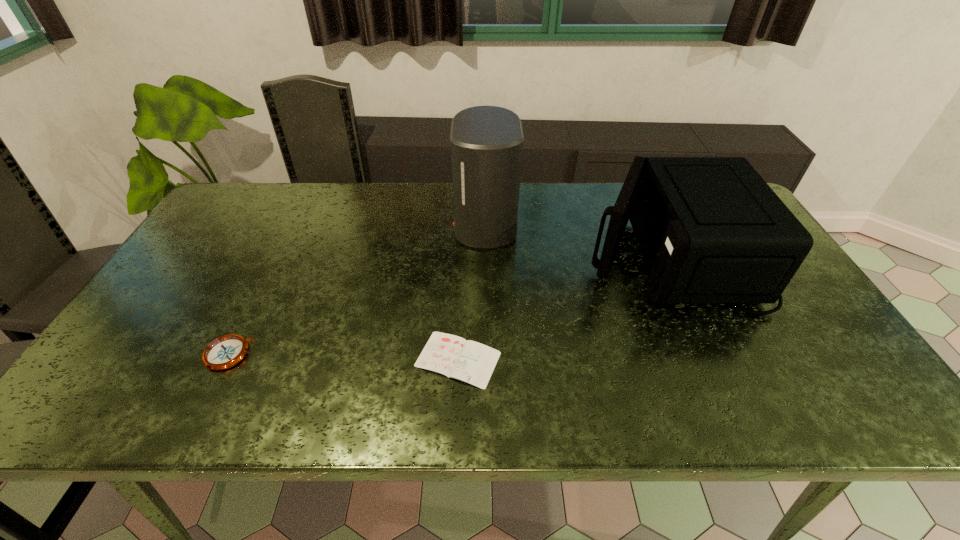
Where is `vacant area located 0.050m with the door open on the rightmost object`? The width and height of the screenshot is (960, 540). vacant area located 0.050m with the door open on the rightmost object is located at coordinates (565, 253).

Locate an element on the screen. vacant space situated with the door open on the rightmost object is located at coordinates (489, 253).

At what (x,y) coordinates should I click in order to perform the action: click on vacant region located 0.090m on the left of the leftmost object. Please return your answer as a coordinate pair (x, y). This screenshot has width=960, height=540. Looking at the image, I should click on (167, 354).

The height and width of the screenshot is (540, 960). In order to click on free spot located on the right of the diary in this screenshot , I will do `click(559, 359)`.

Identify the location of coffee maker situated at the far edge. The height and width of the screenshot is (540, 960). (486, 142).

Locate an element on the screen. The image size is (960, 540). microwave oven that is at the far edge is located at coordinates (712, 231).

You are a GUI agent. You are given a task and a screenshot of the screen. Output one action in this format:
    pyautogui.click(x=<x>, y=<y>)
    Task: Click on the object present at the near edge
    Image resolution: width=960 pixels, height=540 pixels.
    Given the screenshot: What is the action you would take?
    pyautogui.click(x=455, y=357)

Where is `object positioned at the right edge`? This screenshot has width=960, height=540. object positioned at the right edge is located at coordinates (712, 231).

Where is `object at the far right corner`? object at the far right corner is located at coordinates (712, 231).

The height and width of the screenshot is (540, 960). I want to click on vacant space at the far edge, so click(x=601, y=204).